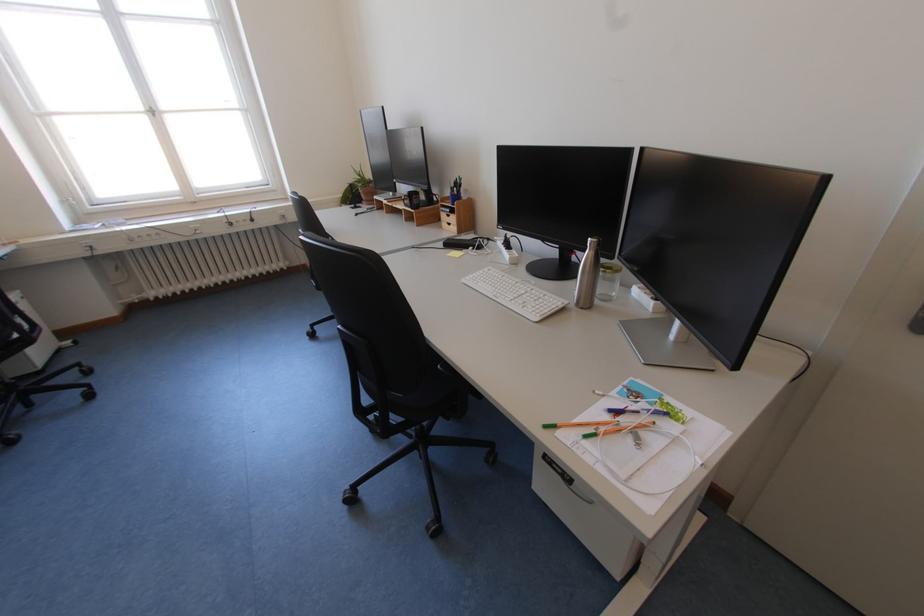
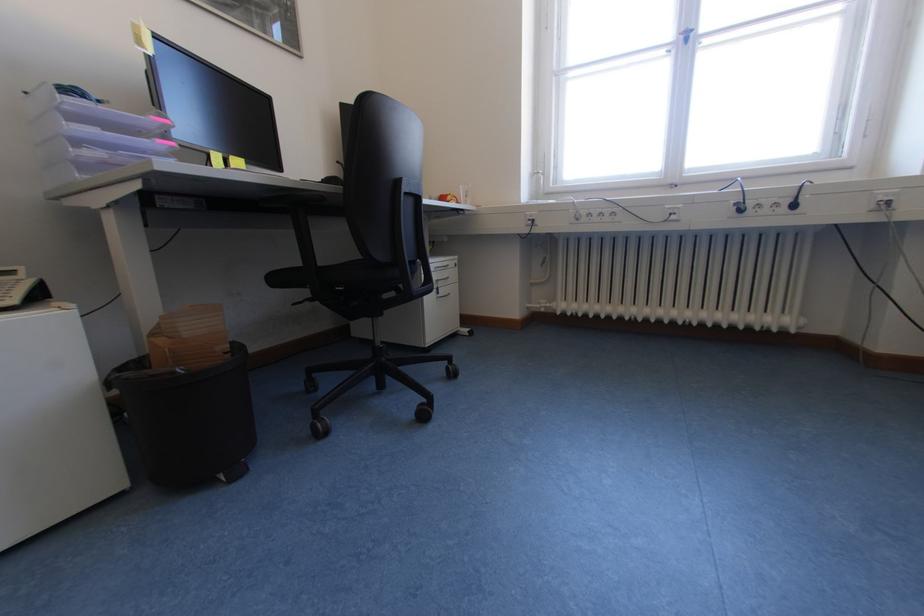
The point at (144, 302) is marked in the first image. Where is the corresponding point in the second image?

(551, 310)